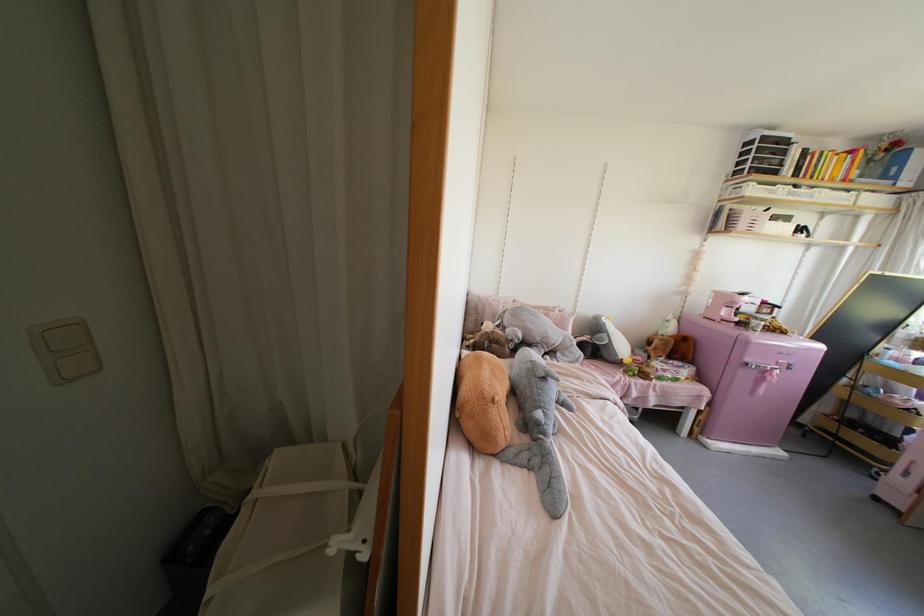
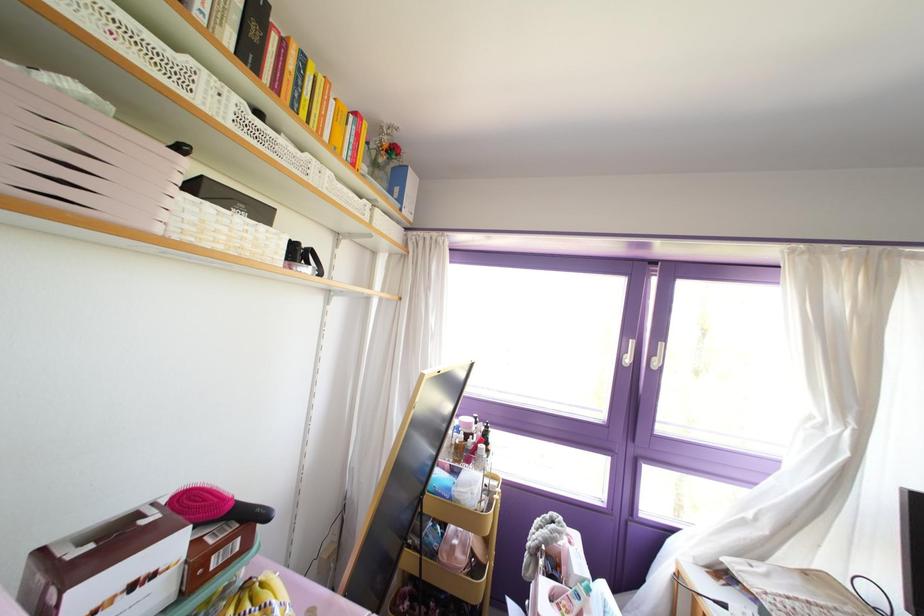
Where in the second image is the point corresponding to the point at 779,223 from the first image?

(237, 219)